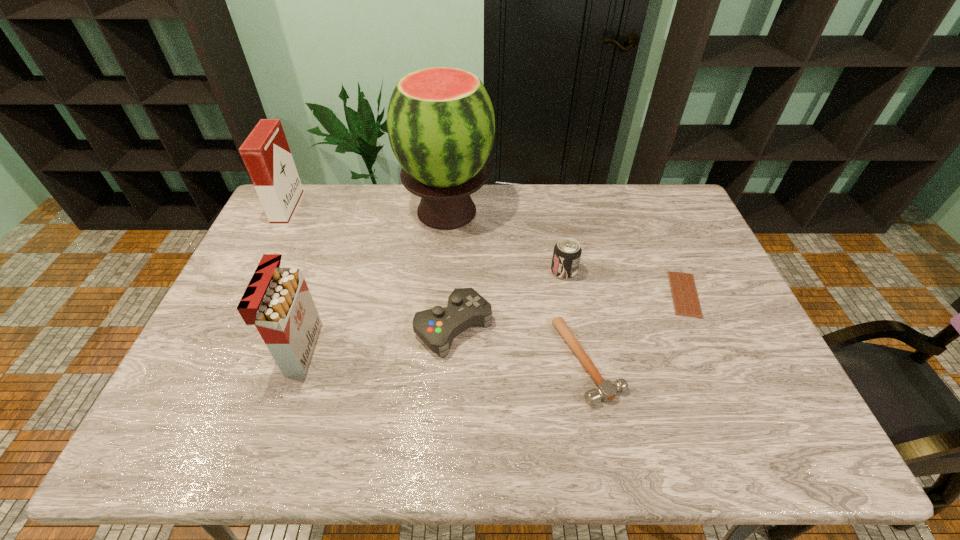
The height and width of the screenshot is (540, 960). I want to click on free point that satisfies the following two spatial constraints: 1. on the front-facing side of the leftmost object; 2. on the right side of the soda can, so click(x=258, y=272).

Find the location of a particular element. This screenshot has height=540, width=960. vacant region that satisfies the following two spatial constraints: 1. on the front-facing side of the leftmost object; 2. on the left side of the fourth tallest object is located at coordinates (258, 272).

I want to click on free space in the image that satisfies the following two spatial constraints: 1. on the front-facing side of the watermelon; 2. on the left side of the left cigarette case, so click(288, 211).